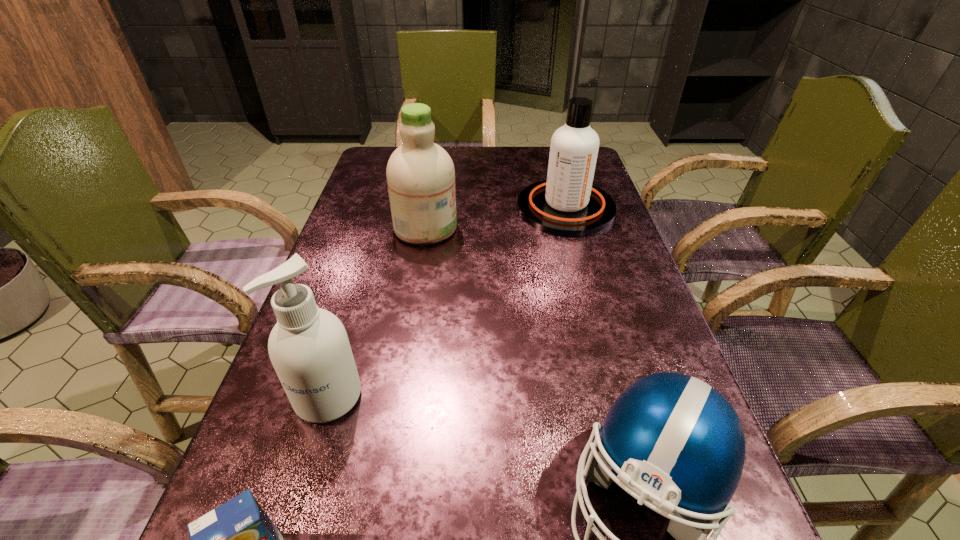
This screenshot has height=540, width=960. What are the coordinates of `the rightmost cleansing agent` in the screenshot? It's located at (566, 204).

You are a GUI agent. You are given a task and a screenshot of the screen. Output one action in this format:
    pyautogui.click(x=<x>, y=<y>)
    Task: Click on the nearest cleansing agent
    
    Given the screenshot: What is the action you would take?
    pyautogui.click(x=309, y=348)

In order to click on blank area located 0.120m on the back of the rightmost cleansing agent in this screenshot , I will do `click(554, 166)`.

At what (x,y) coordinates should I click in order to perform the action: click on blank space located 0.120m on the front label of the nearest cleansing agent. Please return your answer as a coordinate pair (x, y). The width and height of the screenshot is (960, 540). Looking at the image, I should click on (297, 503).

Identify the location of object at the right edge. This screenshot has height=540, width=960. (566, 204).

Locate an element on the screen. free space at the far edge is located at coordinates (452, 153).

The image size is (960, 540). Identify the location of vacant space at the left edge of the desktop. (358, 223).

The image size is (960, 540). I want to click on blank space at the far left corner, so click(x=361, y=179).

Identify the location of free space between the nearest cleansing agent and the rightmost cleansing agent. This screenshot has height=540, width=960. (447, 302).

Find the location of a particular element. free spot between the nearest cleansing agent and the rightmost cleansing agent is located at coordinates (447, 302).